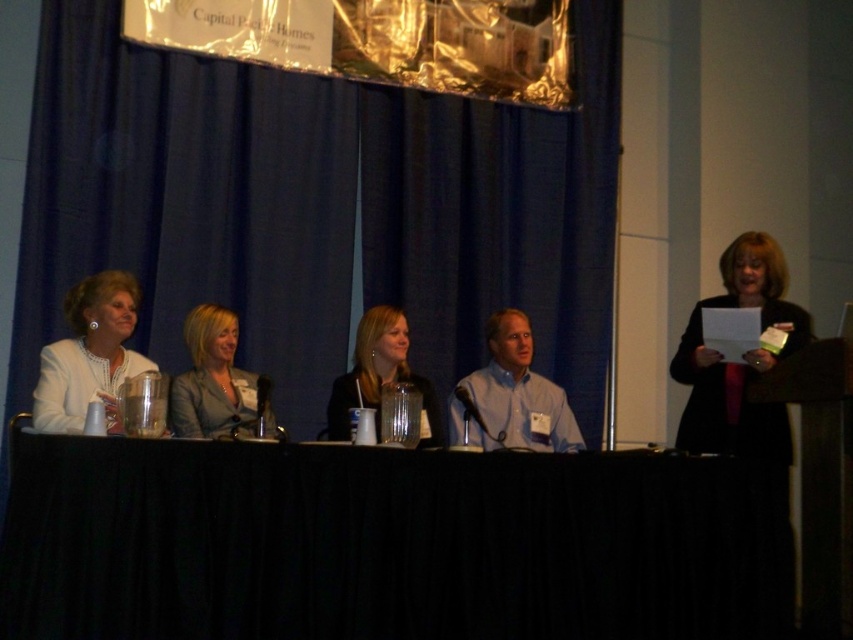
Question: Which point is closer to the camera?

Choices:
 (A) (86, 346)
 (B) (648, 500)
 (C) (343, 406)
 (D) (42, 292)

Answer: (B)

Question: Can you confirm if black fabric table at center is bigger than smooth black jacket at center?

Choices:
 (A) no
 (B) yes

Answer: (B)

Question: Is white fabric jacket at left to the left of light blue shirt at center from the viewer's perspective?

Choices:
 (A) no
 (B) yes

Answer: (B)

Question: Does matte gray blazer at center have a greater width compared to smooth black jacket at center?

Choices:
 (A) yes
 (B) no

Answer: (B)

Question: Estimate the real-world distances between objects in this image. Which object is farther from the white fabric jacket at left?

Choices:
 (A) blue fabric curtain at upper center
 (B) black fabric table at center

Answer: (A)

Question: Among these points, which one is farthest from the camera?

Choices:
 (A) (786, 609)
 (B) (106, 33)
 (C) (357, 355)

Answer: (B)